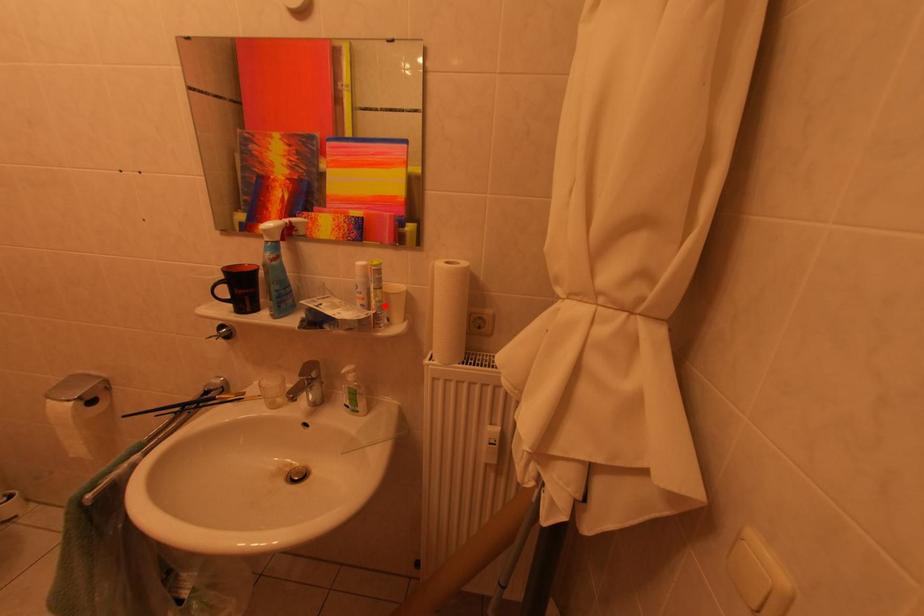
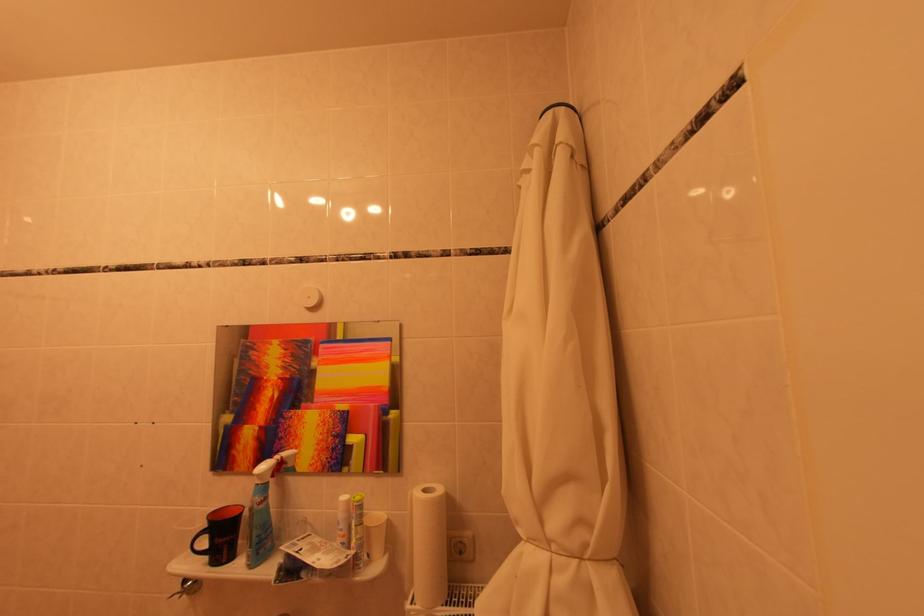
Where in the second image is the point corresponding to the highlighted location from the first image?

(365, 544)